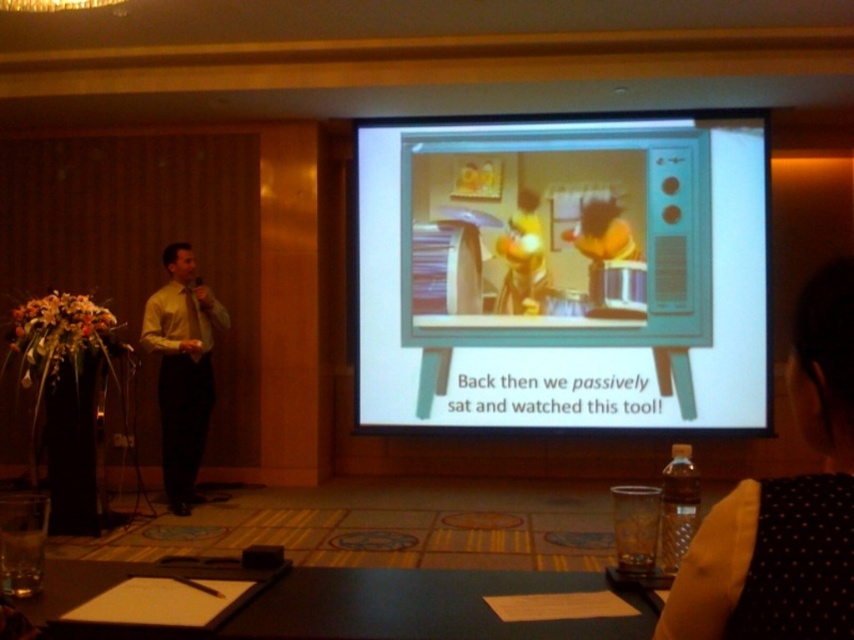
Question: Observing the image, what is the correct spatial positioning of black dotted dress at upper right in reference to yellow shirt at left?

Choices:
 (A) right
 (B) left

Answer: (A)

Question: Estimate the real-world distances between objects in this image. Which object is closer to the black dotted dress at upper right?

Choices:
 (A) matte plastic television at center
 (B) yellow shirt at left
 (C) black leather table at lower center

Answer: (C)

Question: Which of these objects is positioned farthest from the black leather table at lower center?

Choices:
 (A) black dotted dress at upper right
 (B) yellow shirt at left
 (C) matte plastic television at center

Answer: (C)

Question: Which object is farther from the camera taking this photo?

Choices:
 (A) black dotted dress at upper right
 (B) black leather table at lower center
 (C) matte plastic television at center
 (D) yellow shirt at left

Answer: (C)

Question: Observing the image, what is the correct spatial positioning of matte plastic television at center in reference to black dotted dress at upper right?

Choices:
 (A) left
 (B) right

Answer: (B)

Question: Can you confirm if black dotted dress at upper right is positioned to the left of yellow shirt at left?

Choices:
 (A) no
 (B) yes

Answer: (A)